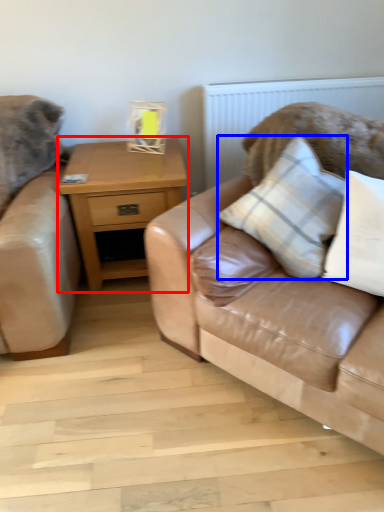
Question: Which of the following is the farthest to the observer, nightstand (highlighted by a red box) or pillow (highlighted by a blue box)?

Choices:
 (A) nightstand
 (B) pillow

Answer: (A)